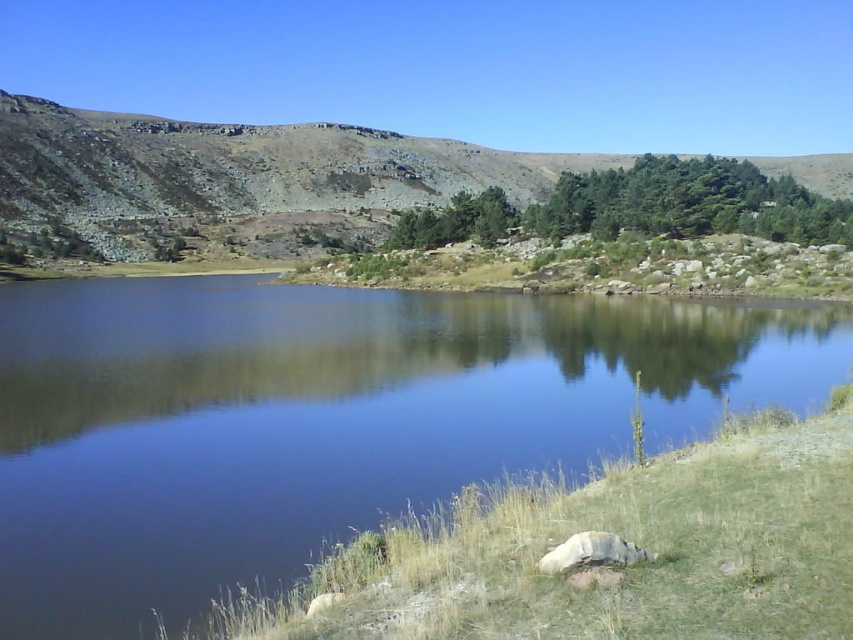
You are standing at the edge of the water in the serene landscape. You see the green grass at lower right and the dull brown rock at upper left. Which object is closer to you?

The green grass at lower right is closer to you because it is only 602.11 feet away from the dull brown rock at upper left, meaning the grass is nearer than the rock.

You are a hiker trying to cross the water in the foreground. You see the green grass at lower right and the dull brown rock at upper left. Which object is shorter, and would stepping on the shorter one be safer for crossing?

The green grass at lower right is shorter than the dull brown rock at upper left. However, stepping on the shorter object may not necessarily be safer for crossing the water since the grass could be slippery or unstable compared to the rock.